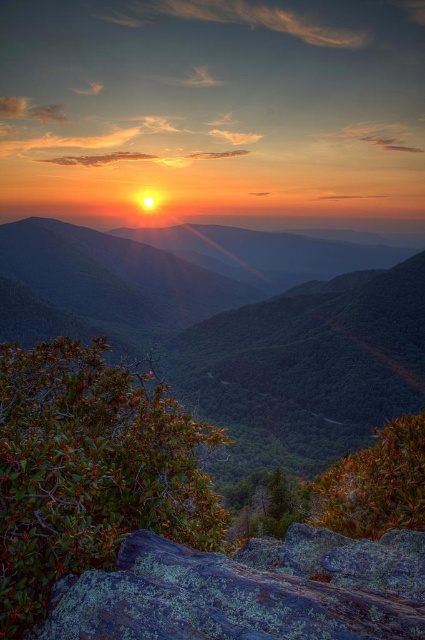
Question: Which of the following is the closest to the observer?

Choices:
 (A) green leafy mountain at center
 (B) green mossy rock at lower center

Answer: (B)

Question: Does green leafy mountain at center have a larger size compared to green mossy rock at lower center?

Choices:
 (A) no
 (B) yes

Answer: (B)

Question: Does green leafy mountain at center appear under green mossy rock at lower center?

Choices:
 (A) no
 (B) yes

Answer: (A)

Question: Does green leafy mountain at center have a lesser width compared to green mossy rock at lower center?

Choices:
 (A) yes
 (B) no

Answer: (B)

Question: Which object appears farthest from the camera in this image?

Choices:
 (A) green mossy rock at lower center
 (B) green leafy mountain at center

Answer: (B)